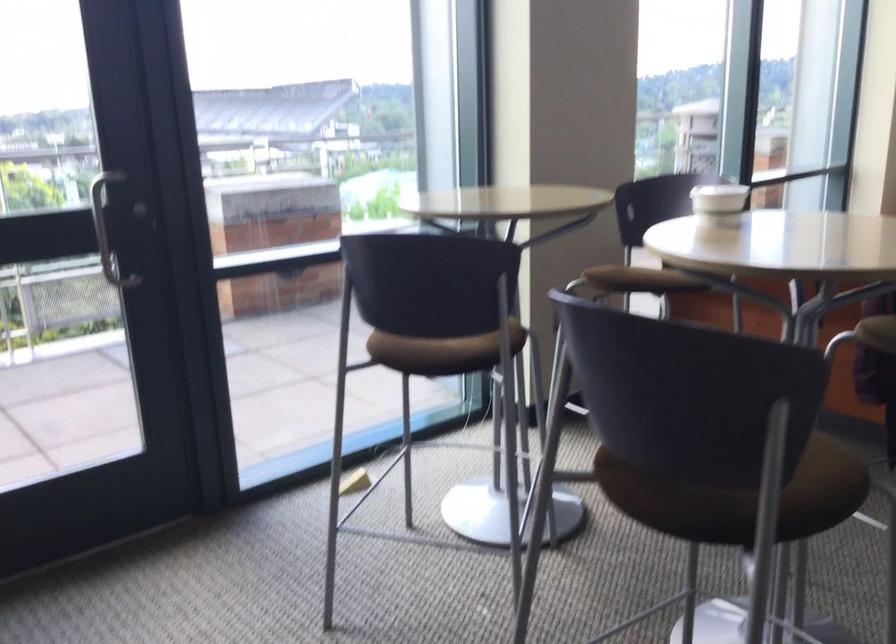
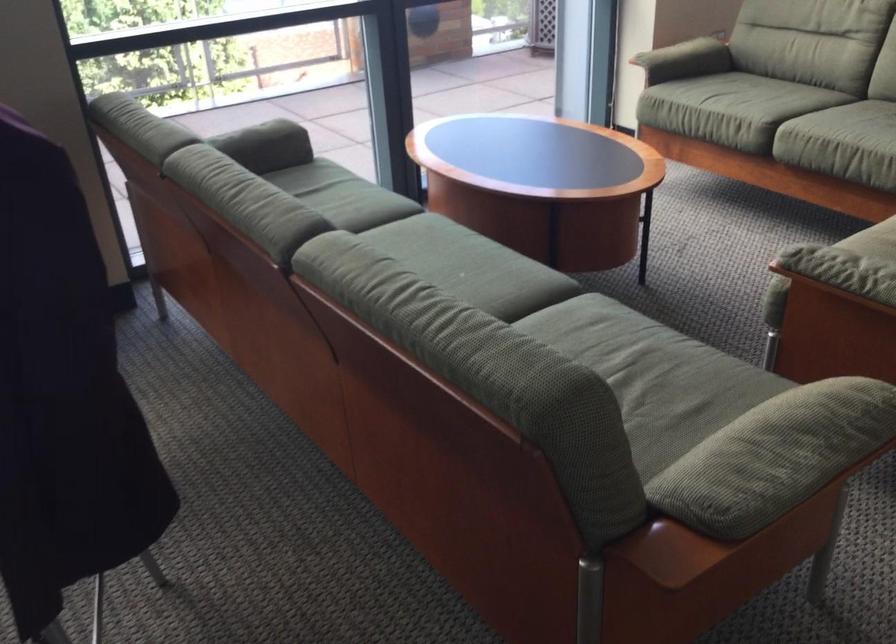
The images are taken continuously from a first-person perspective. In which direction are you moving?

The cameraman walked toward right, forward.